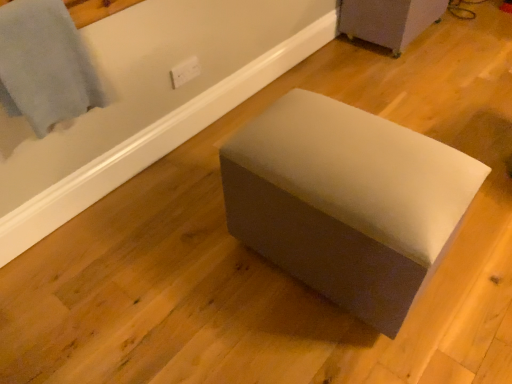
Question: Is light blue fabric at upper left oriented away from suede-like gray ottoman at center, the 2th furniture positioned from the back?

Choices:
 (A) no
 (B) yes

Answer: (A)

Question: Can you confirm if light blue fabric at upper left is taller than suede-like gray ottoman at center, the 1th furniture positioned from the bottom?

Choices:
 (A) no
 (B) yes

Answer: (A)

Question: Considering the relative sizes of light blue fabric at upper left and suede-like gray ottoman at center, the first furniture viewed from the front, in the image provided, is light blue fabric at upper left smaller than suede-like gray ottoman at center, the first furniture viewed from the front,?

Choices:
 (A) no
 (B) yes

Answer: (B)

Question: From the image's perspective, would you say light blue fabric at upper left is shown under suede-like gray ottoman at center, arranged as the second furniture when viewed from the right?

Choices:
 (A) yes
 (B) no

Answer: (B)

Question: From a real-world perspective, is light blue fabric at upper left physically above suede-like gray ottoman at center, placed as the second furniture when sorted from top to bottom?

Choices:
 (A) no
 (B) yes

Answer: (B)

Question: Based on their sizes in the image, would you say light blue fabric at upper left is bigger or smaller than matte gray ottoman at center, which is counted as the first furniture, starting from the back?

Choices:
 (A) small
 (B) big

Answer: (A)

Question: Is light blue fabric at upper left inside or outside of matte gray ottoman at center, the 2th furniture from the bottom?

Choices:
 (A) inside
 (B) outside

Answer: (B)

Question: Is point (26, 69) closer or farther from the camera than point (409, 31)?

Choices:
 (A) closer
 (B) farther

Answer: (A)

Question: Would you say light blue fabric at upper left is to the left or to the right of matte gray ottoman at center, which ranks as the first furniture in top-to-bottom order, in the picture?

Choices:
 (A) left
 (B) right

Answer: (A)

Question: From a real-world perspective, is suede-like gray ottoman at center, placed as the second furniture when sorted from top to bottom, positioned above or below light blue fabric at upper left?

Choices:
 (A) below
 (B) above

Answer: (A)

Question: Considering their positions, is suede-like gray ottoman at center, which appears as the first furniture when viewed from the left, located in front of or behind light blue fabric at upper left?

Choices:
 (A) behind
 (B) front

Answer: (B)

Question: Choose the correct answer: Is suede-like gray ottoman at center, arranged as the second furniture when viewed from the right, inside light blue fabric at upper left or outside it?

Choices:
 (A) outside
 (B) inside

Answer: (A)

Question: From their relative heights in the image, would you say suede-like gray ottoman at center, arranged as the second furniture when viewed from the right, is taller or shorter than light blue fabric at upper left?

Choices:
 (A) short
 (B) tall

Answer: (B)

Question: From the image's perspective, is matte gray ottoman at center, which is counted as the first furniture, starting from the back, above or below light blue fabric at upper left?

Choices:
 (A) below
 (B) above

Answer: (B)

Question: Is matte gray ottoman at center, the 2th furniture positioned from the front, inside the boundaries of light blue fabric at upper left, or outside?

Choices:
 (A) inside
 (B) outside

Answer: (B)